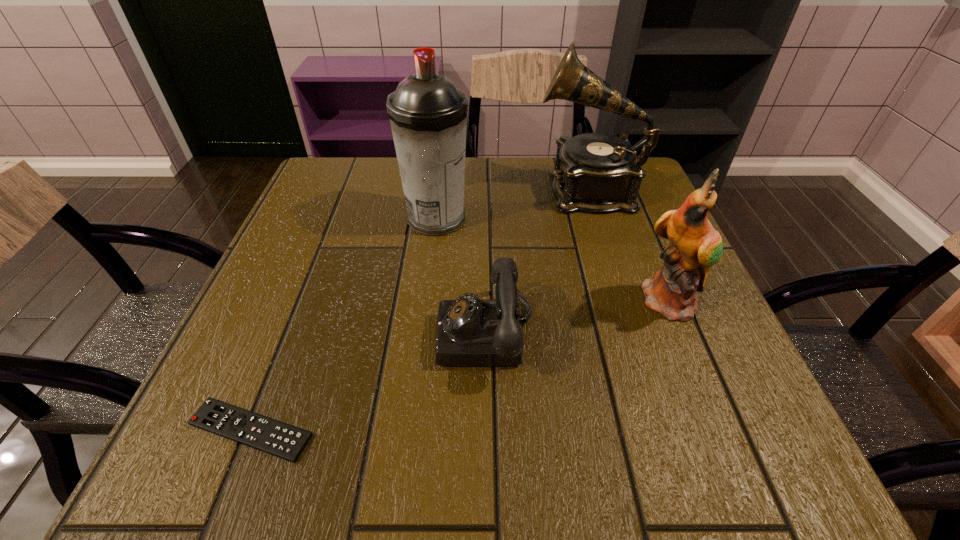
Locate an element on the screen. The width and height of the screenshot is (960, 540). parrot that is at the right edge is located at coordinates (695, 246).

Identify the location of object that is at the near left corner. This screenshot has width=960, height=540. (285, 441).

Locate an element on the screen. This screenshot has height=540, width=960. object at the far right corner is located at coordinates (594, 172).

Locate an element on the screen. Image resolution: width=960 pixels, height=540 pixels. free region at the far edge of the desktop is located at coordinates (546, 200).

The image size is (960, 540). I want to click on vacant region at the near edge of the desktop, so click(x=485, y=424).

Find the location of a particular element. The width and height of the screenshot is (960, 540). blank space at the left edge of the desktop is located at coordinates (274, 366).

Where is `vacant space at the right edge of the desktop`? vacant space at the right edge of the desktop is located at coordinates (720, 319).

Find the location of `vacant space at the far left corner`. vacant space at the far left corner is located at coordinates (354, 186).

Find the location of a particular element. vacant space at the near right corner is located at coordinates (684, 417).

At what (x,y) coordinates should I click in order to perform the action: click on free area in between the parrot and the aerosol can. Please return your answer as a coordinate pair (x, y). This screenshot has width=960, height=540. Looking at the image, I should click on point(555,261).